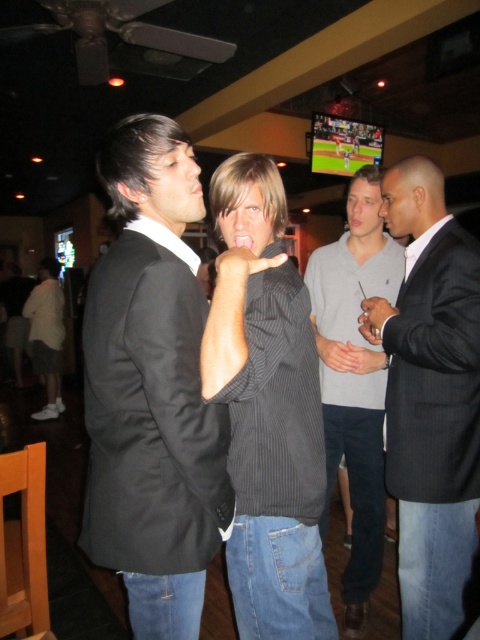
You are a photographer holding a camera. You want to take a photo of the black pinstripe suit at right without moving the camera. Can you do it?

The black pinstripe suit at right and camera are 1.43 meters apart from each other, so yes, you can take a photo of the black pinstripe suit at right without moving the camera since the distance is sufficient for a clear shot.

You are a photographer at the event and need to decide which clothing item takes up less space horizontally. Based on the scene, which is thinner between the black pinstripe suit at right and the white cotton shirt at lower left?

The black pinstripe suit at right is thinner than the white cotton shirt at lower left according to the description.

You are a photographer at the event and want to capture a photo that includes both the dark gray pinstripe suit at right and the gray cotton sweater at center. Which one should you focus on to ensure the other appears in the background?

You should focus on the dark gray pinstripe suit at right because it is in front of the gray cotton sweater at center, so the gray cotton sweater at center will naturally appear in the background.